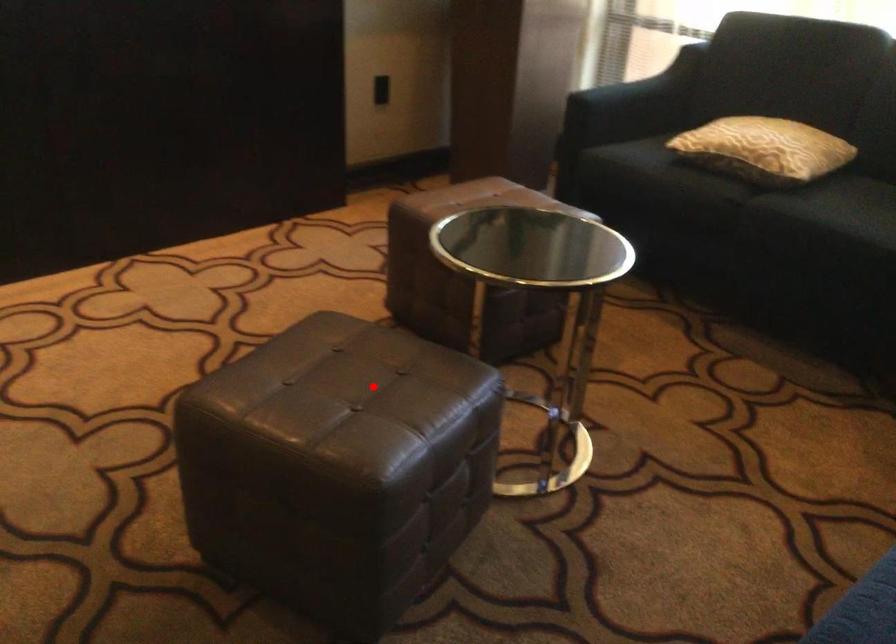
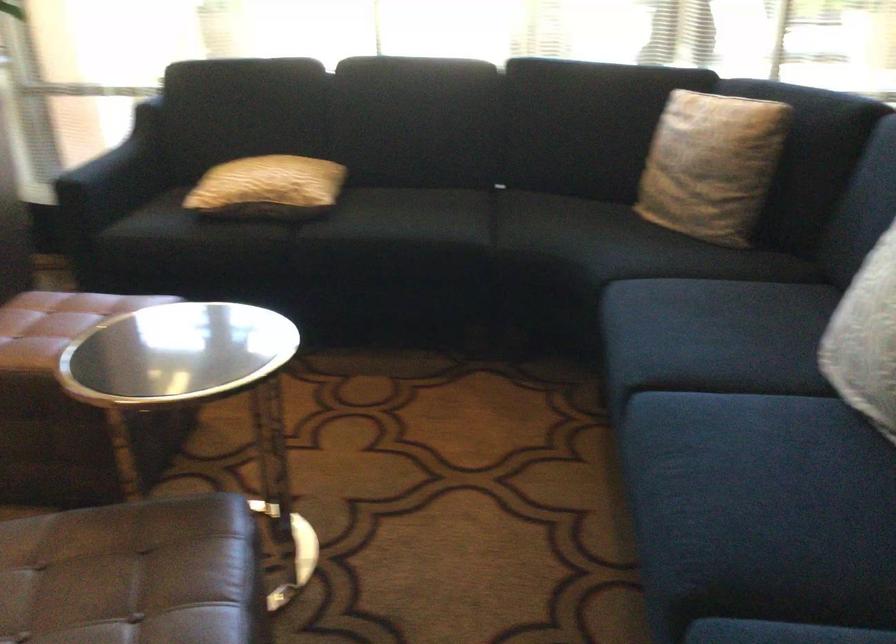
Question: I am providing you with two images of the same scene from different viewpoints. Image1 has a red point marked. In image2, the corresponding 3D location appears at what relative position? Reply with the corresponding letter.

Choices:
 (A) Closer
 (B) Farther

Answer: (A)